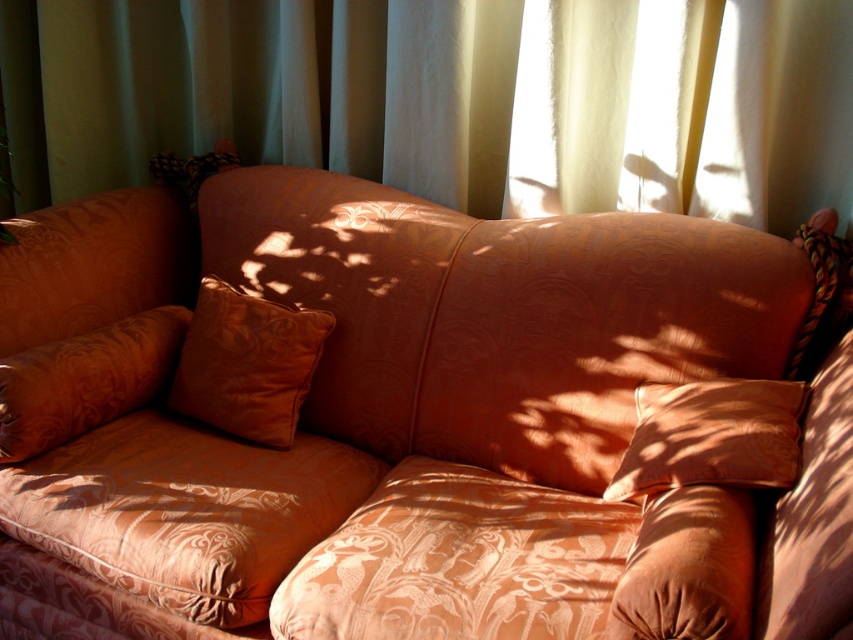
Which is behind, point (675, 460) or point (241, 339)?

The point (241, 339) is more distant.

Is satin orange pillow at lower right to the right of satin orange pillow at center from the viewer's perspective?

Indeed, satin orange pillow at lower right is positioned on the right side of satin orange pillow at center.

Describe the element at coordinates (711, 436) in the screenshot. The width and height of the screenshot is (853, 640). I see `satin orange pillow at lower right` at that location.

Where is `satin orange pillow at lower right`? The image size is (853, 640). satin orange pillow at lower right is located at coordinates (711, 436).

Is point (625, 586) farther from camera compared to point (728, 476)?

No.

This screenshot has width=853, height=640. Identify the location of matte orange couch at center. (405, 422).

Identify the location of matte orange couch at center. (405, 422).

Can you confirm if white sheer curtain at upper center is thinner than satin orange pillow at center?

No, white sheer curtain at upper center is not thinner than satin orange pillow at center.

Locate an element on the screen. This screenshot has height=640, width=853. white sheer curtain at upper center is located at coordinates (451, 99).